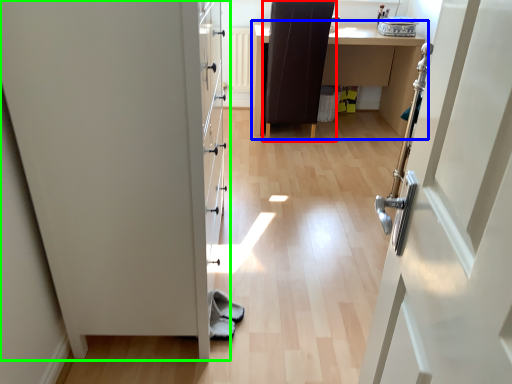
Question: Which object is positioned closest to chair (highlighted by a red box)? Select from table (highlighted by a blue box) and door (highlighted by a green box).

Choices:
 (A) table
 (B) door

Answer: (A)